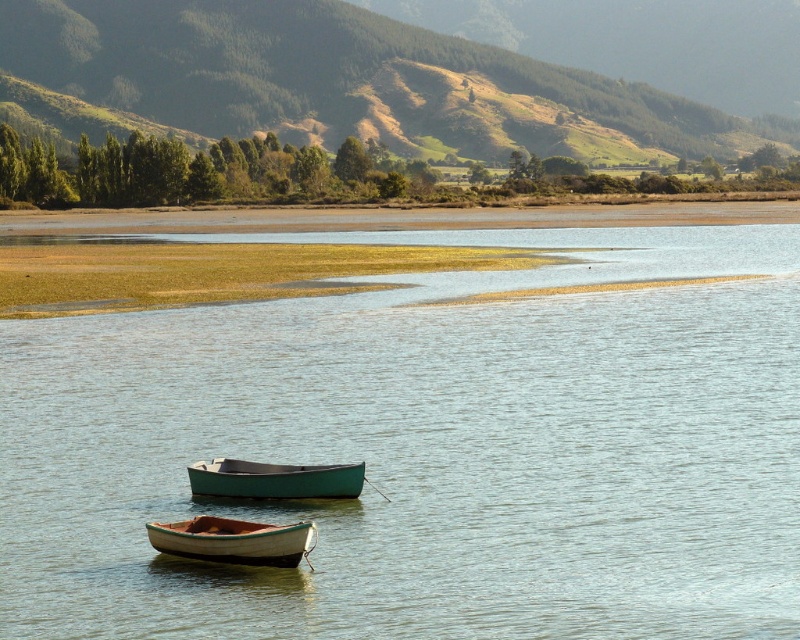
You are standing on the dock and see the point marked at coordinates (428,448). What object is located at that point?

The point at coordinates (428,448) indicates green wood boats at center.

You are a photographer trying to capture both the green wood boats at center and the wooden canoe at lower center in a single frame. Based on their heights, which object will appear larger in your photo?

The green wood boats at center will appear larger in the photo because it is much taller than the wooden canoe at lower center.

In the scene shown: You are standing at the edge of the water and see the green grassy hillside at upper center and the wooden canoe at lower center. Which object is wider?

The green grassy hillside at upper center might be wider than wooden canoe at lower center.